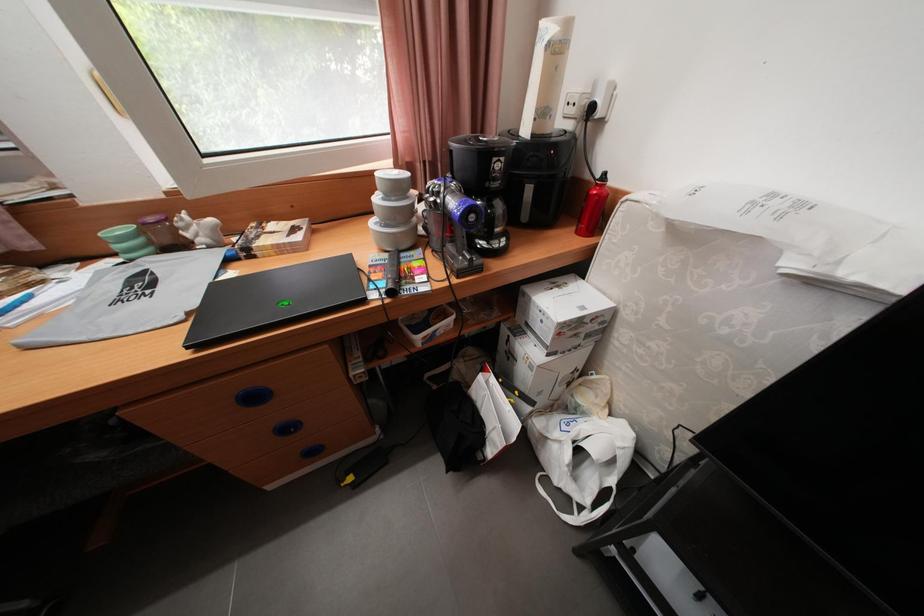
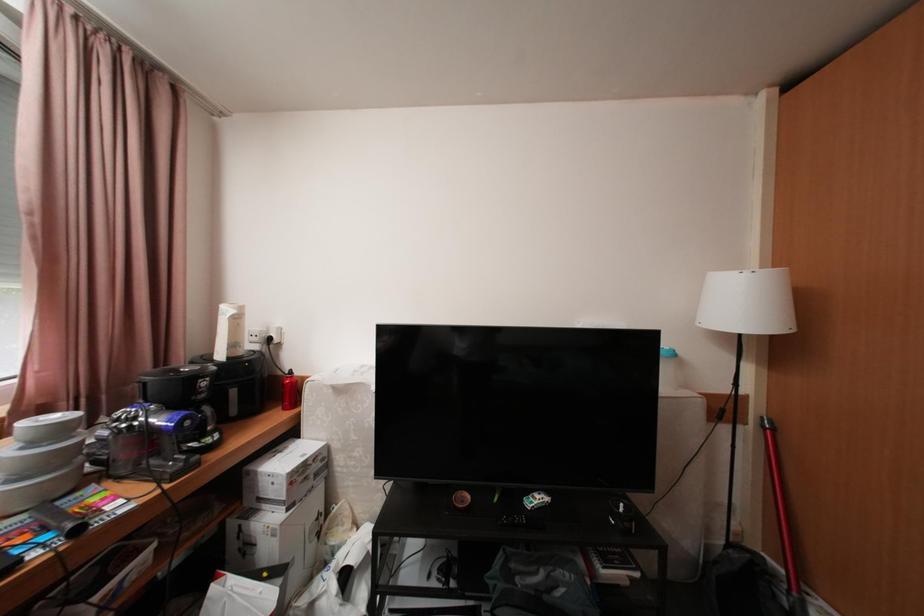
In the scene shown: The first image is from the beginning of the video and the second image is from the end. How did the camera likely rotate when shooting the video?

The camera rotated toward right-up.